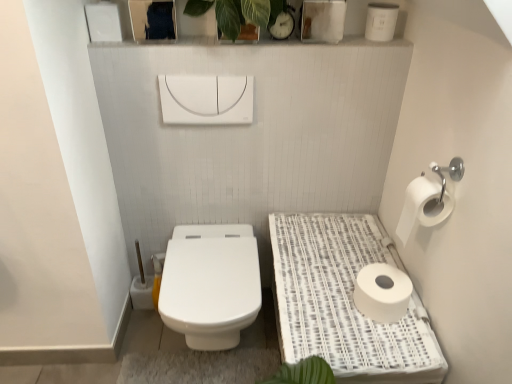
Question: Does point tap(368, 302) appear closer or farther from the camera than point tap(440, 190)?

Choices:
 (A) farther
 (B) closer

Answer: (A)

Question: Is white matte toilet paper at lower right, placed as the 2th toilet paper when sorted from top to bottom, taller or shorter than white matte toilet paper at right, marked as the first toilet paper in a top-to-bottom arrangement?

Choices:
 (A) tall
 (B) short

Answer: (B)

Question: Which of these objects is positioned farthest from the white woven tray at right?

Choices:
 (A) white matte toilet paper at lower right, placed as the 2th toilet paper when sorted from top to bottom
 (B) white glossy toilet at center
 (C) green leafy plant at upper center
 (D) white matte toilet paper at right, marked as the first toilet paper in a top-to-bottom arrangement

Answer: (C)

Question: Which of these objects is positioned closest to the green leafy plant at upper center?

Choices:
 (A) white matte toilet paper at right, which is the 2th toilet paper in bottom-to-top order
 (B) white matte toilet paper at lower right, placed as the 2th toilet paper when sorted from top to bottom
 (C) white glossy toilet at center
 (D) white woven tray at right

Answer: (A)